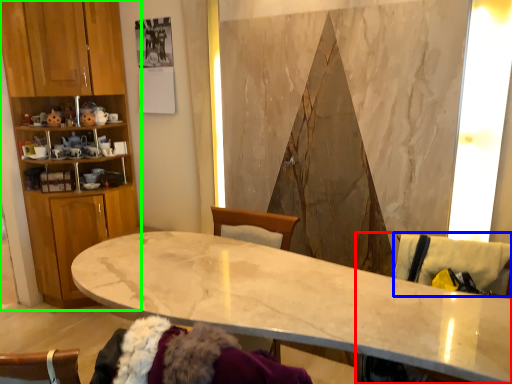
Question: Which object is the closest to the swivel chair (highlighted by a red box)? Choose among these: swivel chair (highlighted by a blue box) or cabinetry (highlighted by a green box).

Choices:
 (A) swivel chair
 (B) cabinetry

Answer: (A)